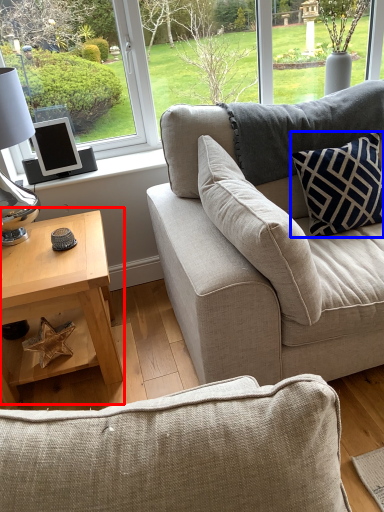
Question: Which point is further to the camera, coffee table (highlighted by a red box) or pillow (highlighted by a blue box)?

Choices:
 (A) coffee table
 (B) pillow

Answer: (B)